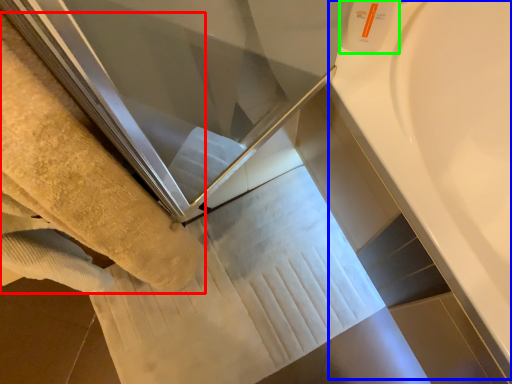
Question: Which object is positioned farthest from towel (highlighted by a red box)? Select from bath (highlighted by a blue box) and toiletry (highlighted by a green box).

Choices:
 (A) bath
 (B) toiletry

Answer: (A)